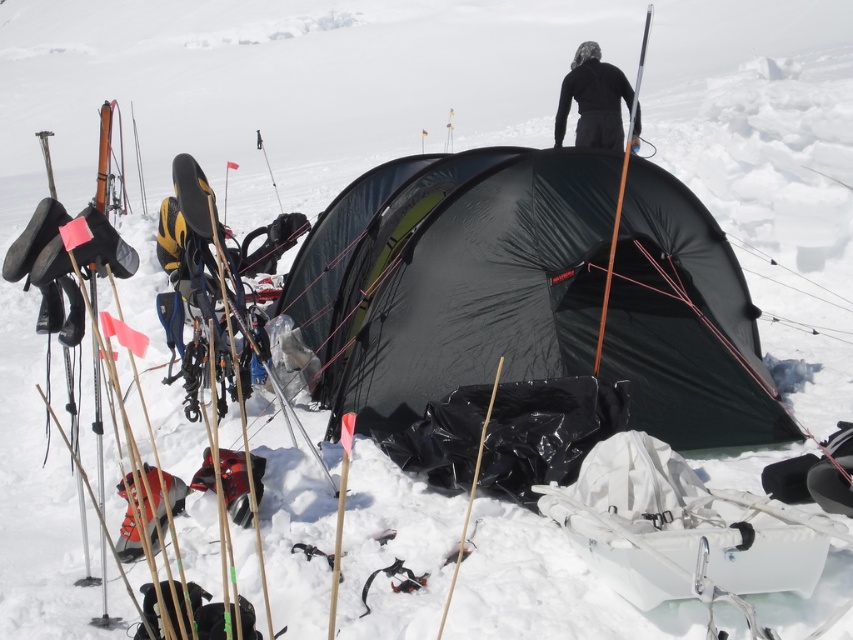
You are a hiker who needs to determine if your backpack can fit under the black tarpaulin tent at center without touching the top. You know your backpack is the same size as the black matte jacket at upper center. Can your backpack fit under the tent?

The black tarpaulin tent at center is taller than the black matte jacket at upper center. Since your backpack is the same size as the jacket, it should fit under the tent without touching the top.

You are a hiker who just arrived at the campsite. You see the black tarpaulin tent at center and the black matte jacket at upper center. Which object is positioned higher in the image?

The black matte jacket at upper center is positioned higher in the image than the black tarpaulin tent at center.